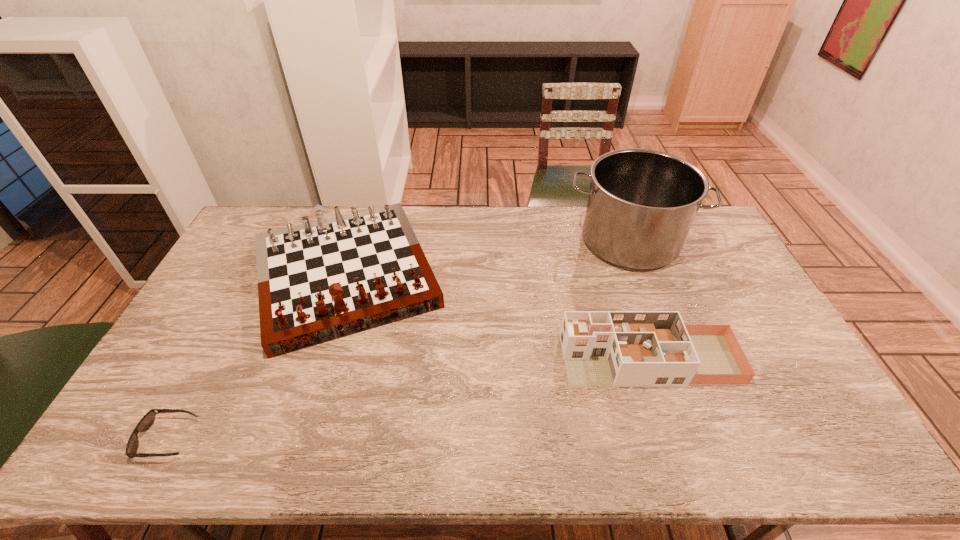
Where is `saucepan`? This screenshot has height=540, width=960. saucepan is located at coordinates (642, 202).

Find the location of `the second tallest object`. the second tallest object is located at coordinates (319, 281).

Find the location of a particular element. This screenshot has height=540, width=960. the second shortest object is located at coordinates (600, 348).

This screenshot has height=540, width=960. I want to click on the shortest object, so click(x=146, y=422).

Where is `the nearest object`? Image resolution: width=960 pixels, height=540 pixels. the nearest object is located at coordinates (146, 422).

Locate an element on the screen. This screenshot has height=540, width=960. vacant space located on the front of the tallest object is located at coordinates (666, 336).

The width and height of the screenshot is (960, 540). I want to click on free space located on the front of the gameboard, so pos(307,400).

Locate an element on the screen. The image size is (960, 540). free space located 0.310m at the entrance of the second shortest object is located at coordinates (453, 360).

Where is `free space located 0.190m at the entrance of the second shortest object`? The width and height of the screenshot is (960, 540). free space located 0.190m at the entrance of the second shortest object is located at coordinates (496, 360).

The height and width of the screenshot is (540, 960). Find the location of `free region located 0.070m at the entrance of the second shortest object`. free region located 0.070m at the entrance of the second shortest object is located at coordinates (539, 360).